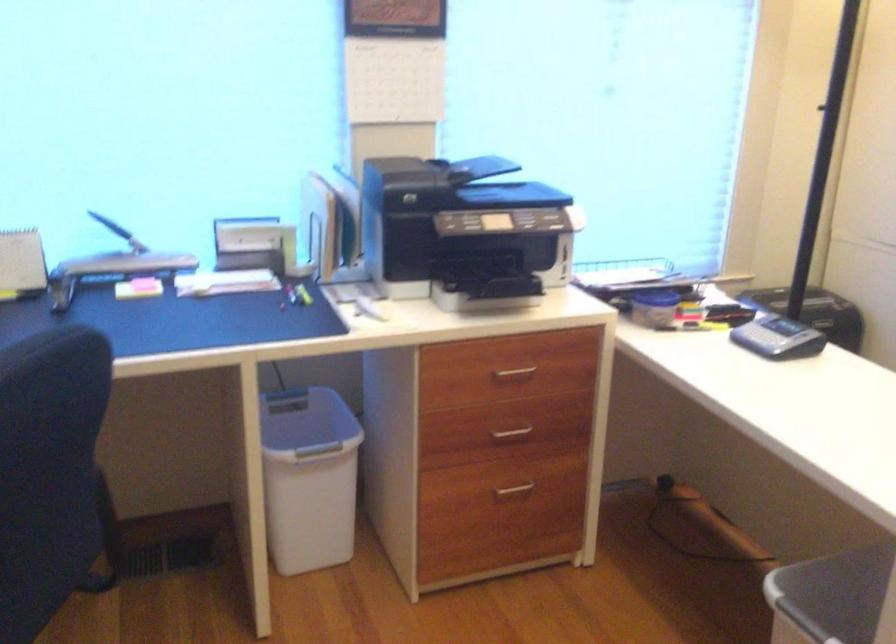
This screenshot has width=896, height=644. In order to click on printer scanner lid in this screenshot , I will do `click(501, 184)`.